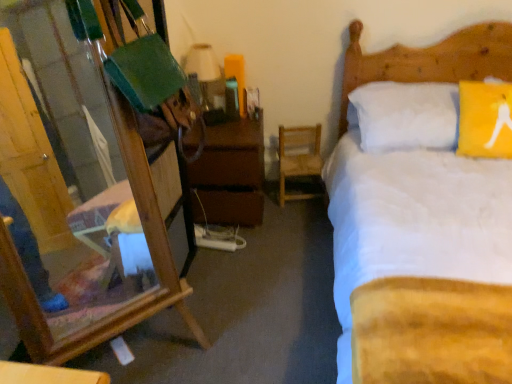
Question: Is matte white lampshade at upper center taller than white soft bed at upper right?

Choices:
 (A) no
 (B) yes

Answer: (A)

Question: Could white soft bed at upper right be considered to be inside matte white lampshade at upper center?

Choices:
 (A) yes
 (B) no

Answer: (B)

Question: Is matte white lampshade at upper center wider than white soft bed at upper right?

Choices:
 (A) yes
 (B) no

Answer: (B)

Question: Is matte white lampshade at upper center at the right side of white soft bed at upper right?

Choices:
 (A) yes
 (B) no

Answer: (B)

Question: Is the position of matte white lampshade at upper center more distant than that of white soft bed at upper right?

Choices:
 (A) yes
 (B) no

Answer: (A)

Question: Considering their positions, is white soft bed at upper right located in front of or behind matte white lampshade at upper center?

Choices:
 (A) behind
 (B) front

Answer: (B)

Question: Looking at their shapes, would you say white soft bed at upper right is wider or thinner than matte white lampshade at upper center?

Choices:
 (A) wide
 (B) thin

Answer: (A)

Question: In terms of size, does white soft bed at upper right appear bigger or smaller than matte white lampshade at upper center?

Choices:
 (A) small
 (B) big

Answer: (B)

Question: Is point (492, 31) positioned closer to the camera than point (198, 66)?

Choices:
 (A) farther
 (B) closer

Answer: (B)

Question: Based on their positions, is brown wooden nightstand at center located to the left or right of wooden mirror at left?

Choices:
 (A) left
 (B) right

Answer: (B)

Question: From a real-world perspective, relative to wooden mirror at left, is brown wooden nightstand at center vertically above or below?

Choices:
 (A) below
 (B) above

Answer: (A)

Question: In the image, is brown wooden nightstand at center positioned in front of or behind wooden mirror at left?

Choices:
 (A) behind
 (B) front

Answer: (A)

Question: From the image's perspective, relative to wooden mirror at left, is brown wooden nightstand at center above or below?

Choices:
 (A) above
 (B) below

Answer: (A)

Question: In terms of width, does white soft bed at upper right look wider or thinner when compared to wooden chair at center?

Choices:
 (A) wide
 (B) thin

Answer: (A)

Question: Does point (464, 69) appear closer or farther from the camera than point (301, 160)?

Choices:
 (A) farther
 (B) closer

Answer: (B)